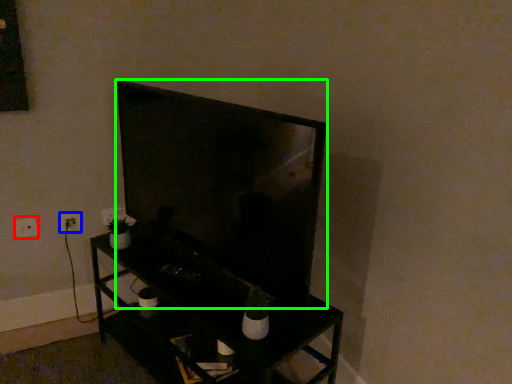
Question: Based on their relative distances, which object is nearer to electric outlet (highlighted by a red box)? Choose from electric outlet (highlighted by a blue box) and television (highlighted by a green box).

Choices:
 (A) electric outlet
 (B) television

Answer: (A)